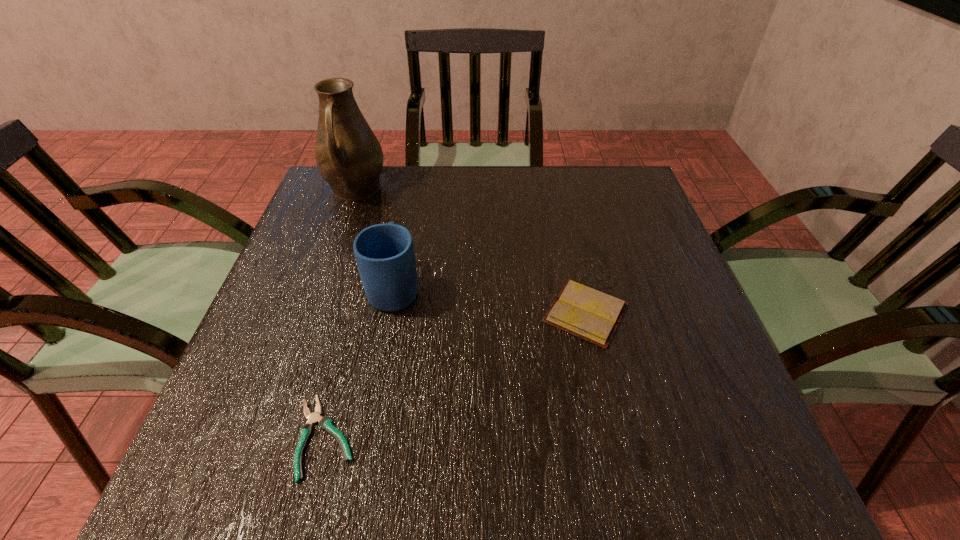
Identify the location of pitcher. This screenshot has height=540, width=960. (349, 157).

Identify the location of the tallest object. pyautogui.click(x=349, y=157).

At what (x,y) coordinates should I click in order to perform the action: click on mug. Please return your answer as a coordinate pair (x, y). Looking at the image, I should click on (384, 253).

Find the location of a particular element. diary is located at coordinates (582, 311).

At what (x,y) coordinates should I click in order to perform the action: click on the third tallest object. Please return your answer as a coordinate pair (x, y). Looking at the image, I should click on (582, 311).

Locate an element on the screen. This screenshot has width=960, height=540. pliers is located at coordinates (325, 423).

The width and height of the screenshot is (960, 540). Identify the location of the nearest object. (325, 423).

This screenshot has width=960, height=540. In order to click on vacant space located 0.130m on the handle side of the farthest object in this screenshot , I will do `click(337, 244)`.

At what (x,y) coordinates should I click in order to perform the action: click on free spot located on the side of the third shortest object with the handle. Please return your answer as a coordinate pair (x, y). The image size is (960, 540). Looking at the image, I should click on (414, 186).

The width and height of the screenshot is (960, 540). I want to click on vacant space located 0.160m on the side of the third shortest object with the handle, so click(408, 219).